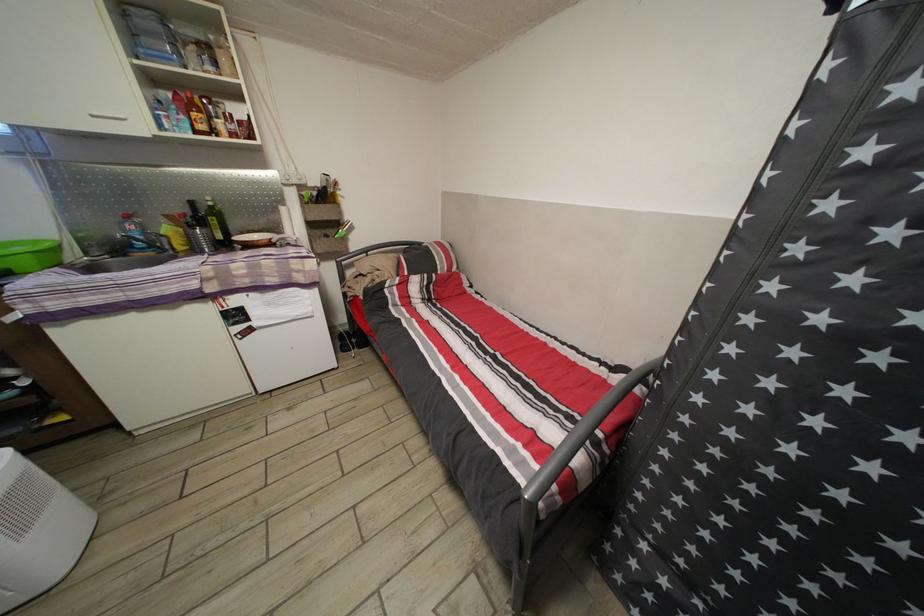
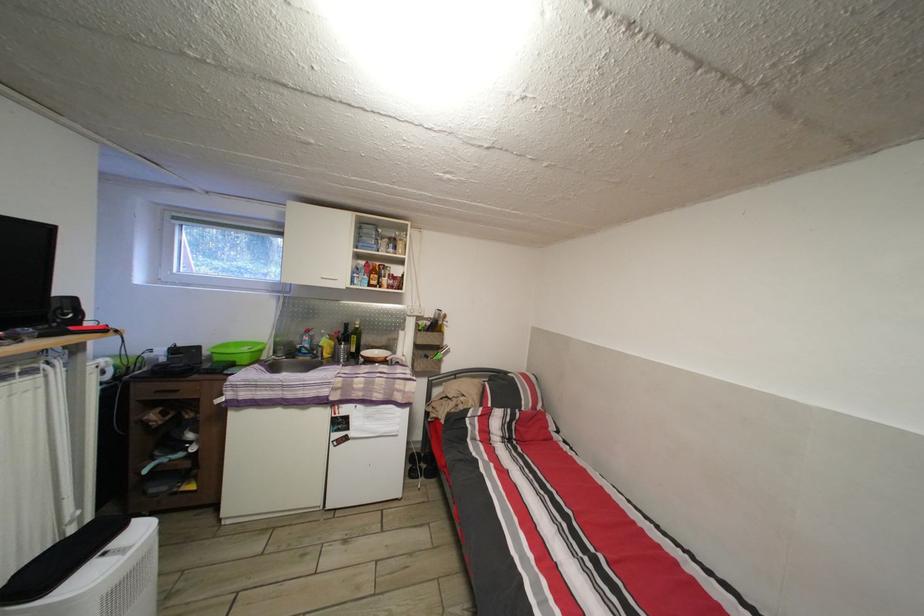
Locate, in the second image, the point that corresponds to point (172, 246) in the first image.

(327, 355)